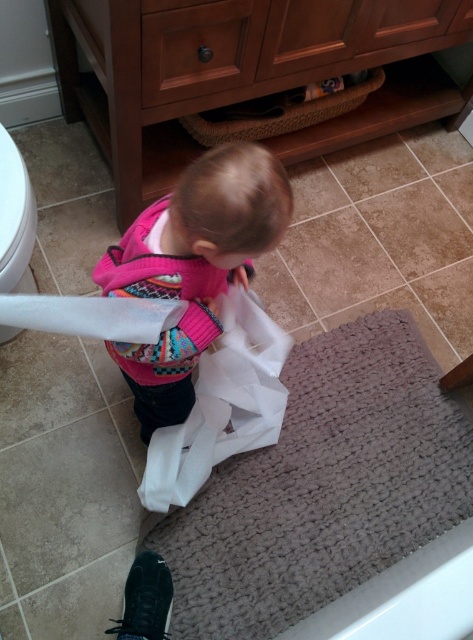
Question: Does white paper towel at lower left lie behind white glossy toilet bowl at lower left?

Choices:
 (A) yes
 (B) no

Answer: (B)

Question: Can you confirm if pink knitted sweater at center is smaller than white paper towel at lower left?

Choices:
 (A) no
 (B) yes

Answer: (A)

Question: Can you confirm if white glossy toilet paper at center is bigger than white glossy toilet bowl at lower left?

Choices:
 (A) no
 (B) yes

Answer: (A)

Question: Which object is positioned closest to the pink knitted sweater at center?

Choices:
 (A) white paper towel at lower left
 (B) white glossy toilet paper at center
 (C) white glossy toilet bowl at lower left

Answer: (A)

Question: Which point is farther to the camera?

Choices:
 (A) pink knitted sweater at center
 (B) white glossy toilet bowl at lower left
 (C) white glossy toilet paper at center

Answer: (C)

Question: Which point is farther to the camera?

Choices:
 (A) white paper towel at lower left
 (B) white glossy toilet paper at center

Answer: (B)